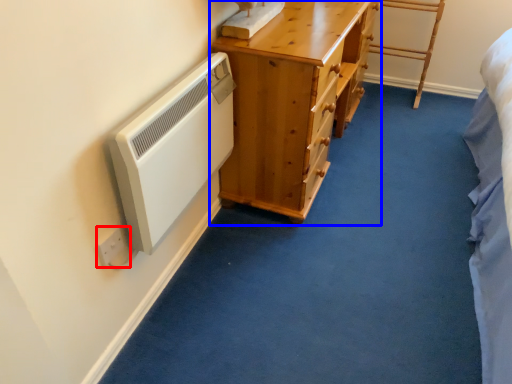
Question: Which object appears farthest to the camera in this image, electric outlet (highlighted by a red box) or chest of drawers (highlighted by a blue box)?

Choices:
 (A) electric outlet
 (B) chest of drawers

Answer: (B)